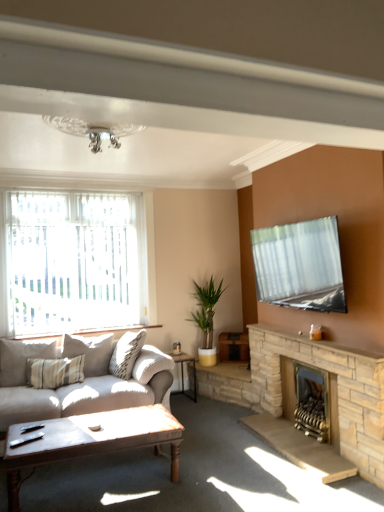
Question: Is stone fireplace at right at the right side of brick fireplace at lower right, the 1th fireplace in the back-to-front sequence?

Choices:
 (A) no
 (B) yes

Answer: (A)

Question: Would you consider stone fireplace at right to be distant from brick fireplace at lower right, which is counted as the 2th fireplace, starting from the front?

Choices:
 (A) no
 (B) yes

Answer: (A)

Question: Does stone fireplace at right turn towards brick fireplace at lower right, the 1th fireplace in the back-to-front sequence?

Choices:
 (A) no
 (B) yes

Answer: (A)

Question: From the image's perspective, is stone fireplace at right located above brick fireplace at lower right, which is counted as the 2th fireplace, starting from the front?

Choices:
 (A) no
 (B) yes

Answer: (B)

Question: Is stone fireplace at right further to camera compared to brick fireplace at lower right, which is counted as the 2th fireplace, starting from the front?

Choices:
 (A) yes
 (B) no

Answer: (B)

Question: From a real-world perspective, is stone fireplace at right physically below brick fireplace at lower right, which is counted as the 2th fireplace, starting from the front?

Choices:
 (A) no
 (B) yes

Answer: (A)

Question: Is stone fireplace at right, which is the 1th fireplace in front-to-back order, completely or partially inside brick fireplace at lower right, which is counted as the 2th fireplace, starting from the front?

Choices:
 (A) yes
 (B) no

Answer: (B)

Question: Can you confirm if brick fireplace at lower right, which is counted as the 2th fireplace, starting from the front, is smaller than stone fireplace at right, the 2th fireplace in the back-to-front sequence?

Choices:
 (A) no
 (B) yes

Answer: (B)

Question: From a real-world perspective, is brick fireplace at lower right, which is counted as the 2th fireplace, starting from the front, below stone fireplace at right, the 2th fireplace in the back-to-front sequence?

Choices:
 (A) yes
 (B) no

Answer: (A)

Question: Would you consider brick fireplace at lower right, which is counted as the 2th fireplace, starting from the front, to be distant from stone fireplace at right, the 2th fireplace in the back-to-front sequence?

Choices:
 (A) yes
 (B) no

Answer: (B)

Question: Does brick fireplace at lower right, which is counted as the 2th fireplace, starting from the front, lie in front of stone fireplace at right, which is the 1th fireplace in front-to-back order?

Choices:
 (A) yes
 (B) no

Answer: (B)

Question: Is brick fireplace at lower right, which is counted as the 2th fireplace, starting from the front, not within stone fireplace at right, which is the 1th fireplace in front-to-back order?

Choices:
 (A) no
 (B) yes

Answer: (A)

Question: Are stone fireplace at right, the 2th fireplace in the back-to-front sequence, and translucent fabric window at left located far from each other?

Choices:
 (A) no
 (B) yes

Answer: (B)